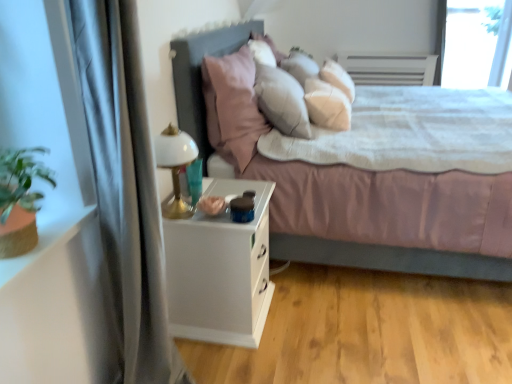
In order to face pink fabric pillow at center, should I rotate leftwards or rightwards?

Rotate left and turn 1.821 degrees.

Locate an element on the screen. white glossy table lamp at left is located at coordinates (175, 166).

In order to click on white matte nightstand at lower left in this screenshot , I will do `click(220, 270)`.

Identify the location of matte gray bed at center. (390, 258).

The height and width of the screenshot is (384, 512). Find the location of `transparent glass window screen at upper right`. transparent glass window screen at upper right is located at coordinates (475, 44).

From a real-world perspective, between white matte nightstand at lower left and matte gray bed at center, who is vertically lower?

white matte nightstand at lower left, from a real-world perspective.

Is white matte nightstand at lower left far from matte gray bed at center?

No, there isn't a large distance between white matte nightstand at lower left and matte gray bed at center.

Between white matte nightstand at lower left and matte gray bed at center, which one has smaller size?

white matte nightstand at lower left.

This screenshot has width=512, height=384. I want to click on bed above the white matte nightstand at lower left (from the image's perspective), so click(390, 258).

Can you tell me how much matte gray bed at center and transparent glass window screen at upper right differ in facing direction?

The angular difference between matte gray bed at center and transparent glass window screen at upper right is 90.3 degrees.

Identify the location of window screen that appears above the matte gray bed at center (from a real-world perspective). (475, 44).

Looking at this image, considering their positions, is matte gray bed at center located in front of or behind transparent glass window screen at upper right?

matte gray bed at center is in front of transparent glass window screen at upper right.

From the image's perspective, is matte gray bed at center located beneath transparent glass window screen at upper right?

Yes, from the image's perspective, matte gray bed at center is beneath transparent glass window screen at upper right.

This screenshot has height=384, width=512. Find the location of `window screen above the silky gray curtain at left (from a real-world perspective)`. window screen above the silky gray curtain at left (from a real-world perspective) is located at coordinates (475, 44).

Which is behind, point (469, 20) or point (119, 197)?

Point (469, 20)

In the image, is transparent glass window screen at upper right positioned in front of or behind silky gray curtain at left?

In the image, transparent glass window screen at upper right appears behind silky gray curtain at left.

Considering the relative positions of transparent glass window screen at upper right and silky gray curtain at left in the image provided, is transparent glass window screen at upper right to the right of silky gray curtain at left from the viewer's perspective?

Yes, transparent glass window screen at upper right is to the right of silky gray curtain at left.

Is white matte nightstand at lower left wider than white glossy table lamp at left?

Indeed, white matte nightstand at lower left has a greater width compared to white glossy table lamp at left.

Is white matte nightstand at lower left oriented towards white glossy table lamp at left?

No, white matte nightstand at lower left is not oriented towards white glossy table lamp at left.

From the image's perspective, does white matte nightstand at lower left appear lower than white glossy table lamp at left?

Yes.

From a real-world perspective, is white glossy table lamp at left under transparent glass window screen at upper right?

Yes, from a real-world perspective, white glossy table lamp at left is beneath transparent glass window screen at upper right.

Considering the relative sizes of white glossy table lamp at left and transparent glass window screen at upper right in the image provided, is white glossy table lamp at left smaller than transparent glass window screen at upper right?

Correct, white glossy table lamp at left occupies less space than transparent glass window screen at upper right.

Is white glossy table lamp at left positioned before transparent glass window screen at upper right?

Yes, white glossy table lamp at left is in front of transparent glass window screen at upper right.

Are white glossy table lamp at left and transparent glass window screen at upper right far apart?

white glossy table lamp at left is positioned a significant distance from transparent glass window screen at upper right.

Is pink fabric pillow at center facing away from white matte nightstand at lower left?

No, white matte nightstand at lower left is not at the back of pink fabric pillow at center.

From the image's perspective, does pink fabric pillow at center appear higher than white matte nightstand at lower left?

Yes, from the image's perspective, pink fabric pillow at center is over white matte nightstand at lower left.

Would you say pink fabric pillow at center is outside white matte nightstand at lower left?

pink fabric pillow at center lies outside white matte nightstand at lower left's area.

Would you say pink fabric pillow at center is to the left or to the right of white matte nightstand at lower left in the picture?

pink fabric pillow at center is positioned on white matte nightstand at lower left's right side.

Can you tell me how much matte gray bed at center and white matte nightstand at lower left differ in facing direction?

0.353 degrees separate the facing orientations of matte gray bed at center and white matte nightstand at lower left.

From a real-world perspective, is matte gray bed at center physically located above or below white matte nightstand at lower left?

matte gray bed at center is situated higher than white matte nightstand at lower left in the real world.

Between matte gray bed at center and white matte nightstand at lower left, which one is positioned in front?

matte gray bed at center is more forward.

Which is farther, (504, 275) or (180, 285)?

The point (504, 275) is more distant.

Where is `bed on the right of white matte nightstand at lower left`? This screenshot has width=512, height=384. bed on the right of white matte nightstand at lower left is located at coordinates (390, 258).

The width and height of the screenshot is (512, 384). I want to click on bed to the left of transparent glass window screen at upper right, so click(x=390, y=258).

When comparing their distances from silky gray curtain at left, does white glossy table lamp at left or transparent glass window screen at upper right seem further?

transparent glass window screen at upper right is further to silky gray curtain at left.

Which object lies nearer to the anchor point white matte nightstand at lower left, white glossy table lamp at left or pink fabric pillow at center?

Among the two, white glossy table lamp at left is located nearer to white matte nightstand at lower left.

Considering their positions, is pink fabric pillow at center positioned further to white glossy table lamp at left than transparent glass window screen at upper right?

transparent glass window screen at upper right is positioned further to the anchor white glossy table lamp at left.

Looking at the image, which one is located closer to silky gray curtain at left, pink fabric pillow at center or white matte nightstand at lower left?

Among the two, white matte nightstand at lower left is located nearer to silky gray curtain at left.

From the picture: From the image, which object appears to be nearer to transparent glass window screen at upper right, pink fabric pillow at center or matte gray bed at center?

Among the two, matte gray bed at center is located nearer to transparent glass window screen at upper right.

Estimate the real-world distances between objects in this image. Which object is closer to pink fabric pillow at center, matte gray bed at center or silky gray curtain at left?

matte gray bed at center is positioned closer to the anchor pink fabric pillow at center.

When comparing their distances from white matte nightstand at lower left, does pink fabric pillow at center or matte gray bed at center seem closer?

pink fabric pillow at center is positioned closer to the anchor white matte nightstand at lower left.

Which object lies nearer to the anchor point matte gray bed at center, pink fabric pillow at center or transparent glass window screen at upper right?

pink fabric pillow at center.

The image size is (512, 384). Identify the location of pillow positioned between matte gray bed at center and transparent glass window screen at upper right from near to far. (232, 106).

At what (x,y) coordinates should I click in order to perform the action: click on nightstand positioned between white glossy table lamp at left and transparent glass window screen at upper right from near to far. Please return your answer as a coordinate pair (x, y). Image resolution: width=512 pixels, height=384 pixels. Looking at the image, I should click on (220, 270).

At what (x,y) coordinates should I click in order to perform the action: click on pillow between white glossy table lamp at left and matte gray bed at center from left to right. Please return your answer as a coordinate pair (x, y). Looking at the image, I should click on (232, 106).

The height and width of the screenshot is (384, 512). What are the coordinates of `table lamp between silky gray curtain at left and transparent glass window screen at upper right in the front-back direction` in the screenshot? It's located at (175, 166).